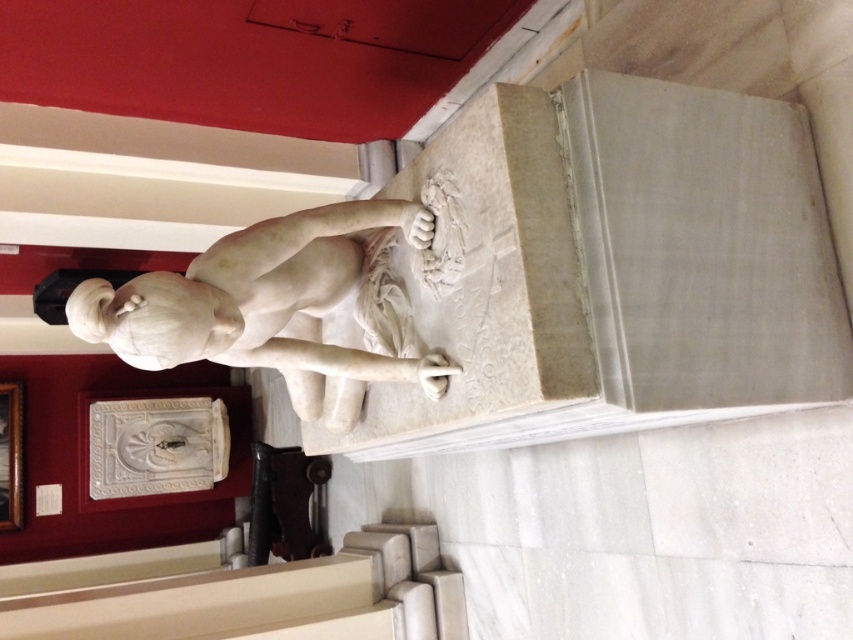
Question: Among these points, which one is nearest to the camera?

Choices:
 (A) (204, 588)
 (B) (379, 216)

Answer: (B)

Question: In this image, where is white marble stairs at lower left located relative to white marble statue at center?

Choices:
 (A) below
 (B) above

Answer: (A)

Question: Is white marble stairs at lower left positioned before white marble statue at center?

Choices:
 (A) yes
 (B) no

Answer: (B)

Question: Does white marble stairs at lower left appear over white marble statue at center?

Choices:
 (A) yes
 (B) no

Answer: (B)